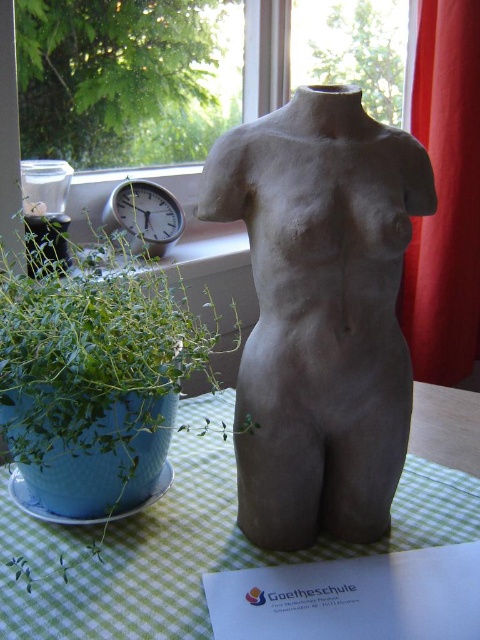
Locate an element on the screen. The width and height of the screenshot is (480, 640). green matte plant at left is located at coordinates (94, 376).

Between green matte plant at left and green checkered tablecloth at center, which one is positioned lower?

Positioned lower is green checkered tablecloth at center.

Is point (128, 289) positioned behind point (227, 460)?

No, it is not.

At what (x,y) coordinates should I click in order to perform the action: click on green matte plant at left. Please return your answer as a coordinate pair (x, y). Looking at the image, I should click on (94, 376).

Which of these two, red fabric curtain at right or silver metallic clock at left, stands taller?

red fabric curtain at right

Does point (415, 218) come behind point (168, 208)?

Yes, point (415, 218) is behind point (168, 208).

The height and width of the screenshot is (640, 480). In order to click on red fabric curtain at right in this screenshot , I will do `click(445, 195)`.

Measure the distance from matte gray torso at center to silver metallic clock at left.

matte gray torso at center is 23.25 inches from silver metallic clock at left.

Can you confirm if matte gray torso at center is positioned below silver metallic clock at left?

Yes.

Which is behind, point (309, 234) or point (127, 218)?

Point (127, 218)

You are a GUI agent. You are given a task and a screenshot of the screen. Output one action in this format:
    pyautogui.click(x=<x>, y=<y>)
    Task: Click on the matte gray torso at center
    This screenshot has width=480, height=640.
    Given the screenshot: What is the action you would take?
    pyautogui.click(x=321, y=312)